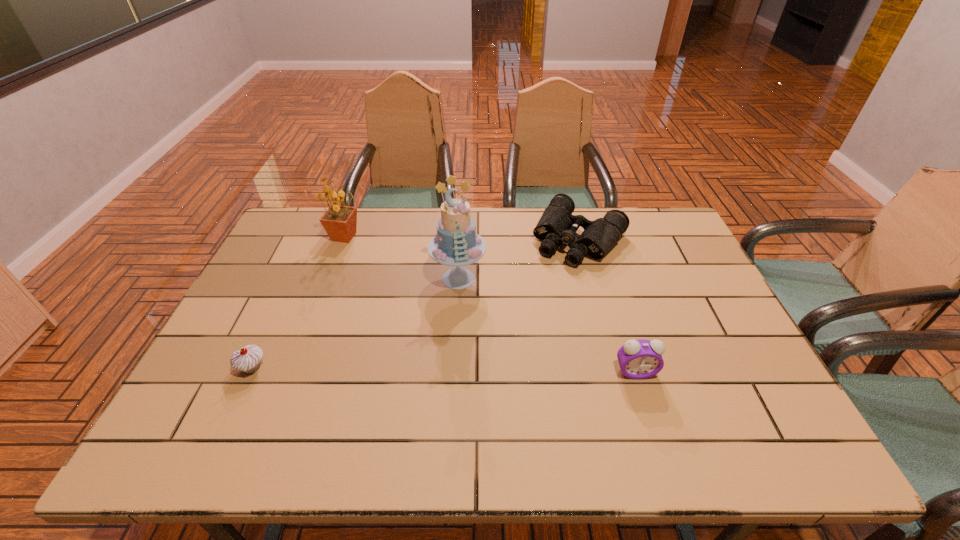
This screenshot has width=960, height=540. What are the coordinates of `free region located with a ladder on the side of the tallest object` in the screenshot? It's located at (399, 379).

The image size is (960, 540). Find the location of `free region located at the front of the second tallest object with flowers visible`. free region located at the front of the second tallest object with flowers visible is located at coordinates (367, 265).

You are a GUI agent. You are given a task and a screenshot of the screen. Output one action in this format:
    pyautogui.click(x=<x>, y=<y>)
    Task: Click on the free location located at the front of the second tallest object with flowers visible
    This screenshot has width=960, height=540.
    Given the screenshot: What is the action you would take?
    pyautogui.click(x=387, y=290)

Locate an element on the screen. vacant space located at the front of the second tallest object with flowers visible is located at coordinates (371, 269).

This screenshot has width=960, height=540. What are the coordinates of `free spot located 0.370m through the eyepieces of the binoculars` in the screenshot? It's located at (504, 346).

Image resolution: width=960 pixels, height=540 pixels. What are the coordinates of `vacant region located 0.300m through the eyepieces of the binoculars` in the screenshot? It's located at (516, 328).

The width and height of the screenshot is (960, 540). I want to click on vacant space located 0.180m through the eyepieces of the binoculars, so click(536, 301).

You are a GUI agent. You are given a task and a screenshot of the screen. Output one action in this format:
    pyautogui.click(x=<x>, y=<y>)
    Task: Click on the sunflower at the far edge
    Image resolution: width=960 pixels, height=540 pixels.
    Given the screenshot: What is the action you would take?
    pyautogui.click(x=339, y=221)

Identify the location of binoculars located in the far edge section of the desktop. The image size is (960, 540). (557, 225).

This screenshot has width=960, height=540. Find the location of `object that is at the left edge`. object that is at the left edge is located at coordinates (247, 359).